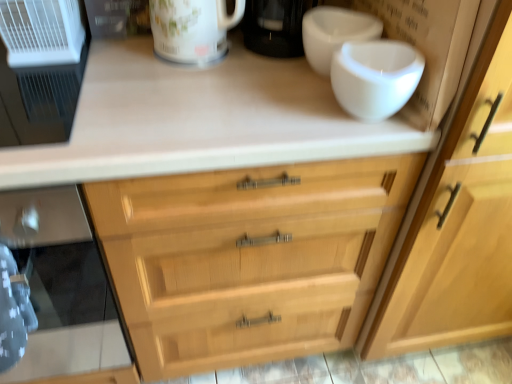
Question: Is glossy ceramic mug at upper center located within white glossy bowl at upper right?

Choices:
 (A) no
 (B) yes

Answer: (A)

Question: From a real-world perspective, does white glossy bowl at upper right stand above glossy ceramic mug at upper center?

Choices:
 (A) yes
 (B) no

Answer: (B)

Question: Is white glossy bowl at upper right shorter than glossy ceramic mug at upper center?

Choices:
 (A) yes
 (B) no

Answer: (A)

Question: Does white glossy bowl at upper right have a greater width compared to glossy ceramic mug at upper center?

Choices:
 (A) no
 (B) yes

Answer: (A)

Question: Does white glossy bowl at upper right have a smaller size compared to glossy ceramic mug at upper center?

Choices:
 (A) yes
 (B) no

Answer: (A)

Question: From the image's perspective, does white glossy bowl at upper right appear lower than glossy ceramic mug at upper center?

Choices:
 (A) yes
 (B) no

Answer: (A)

Question: Is glossy ceramic mug at upper center outside of white plastic cage at upper left, which is counted as the second appliance, starting from the bottom?

Choices:
 (A) yes
 (B) no

Answer: (A)

Question: Is glossy ceramic mug at upper center not near white plastic cage at upper left, the first appliance in the top-to-bottom sequence?

Choices:
 (A) yes
 (B) no

Answer: (B)

Question: Can you confirm if glossy ceramic mug at upper center is thinner than white plastic cage at upper left, which is counted as the second appliance, starting from the bottom?

Choices:
 (A) yes
 (B) no

Answer: (A)

Question: Is glossy ceramic mug at upper center to the right of white plastic cage at upper left, which is counted as the second appliance, starting from the bottom, from the viewer's perspective?

Choices:
 (A) no
 (B) yes

Answer: (B)

Question: Is glossy ceramic mug at upper center wider than white plastic cage at upper left, which is counted as the second appliance, starting from the bottom?

Choices:
 (A) no
 (B) yes

Answer: (A)

Question: Can you confirm if glossy ceramic mug at upper center is smaller than white plastic cage at upper left, the first appliance in the top-to-bottom sequence?

Choices:
 (A) yes
 (B) no

Answer: (B)

Question: From the image's perspective, does white glossy bowl at upper right appear lower than black glass oven at left?

Choices:
 (A) yes
 (B) no

Answer: (B)